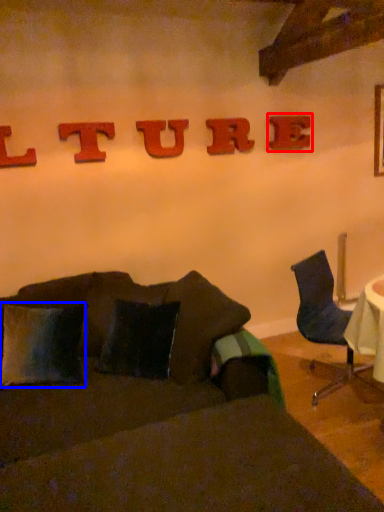
Question: Which object appears closest to the camera in this image, alphabet (highlighted by a red box) or pillow (highlighted by a blue box)?

Choices:
 (A) alphabet
 (B) pillow

Answer: (B)